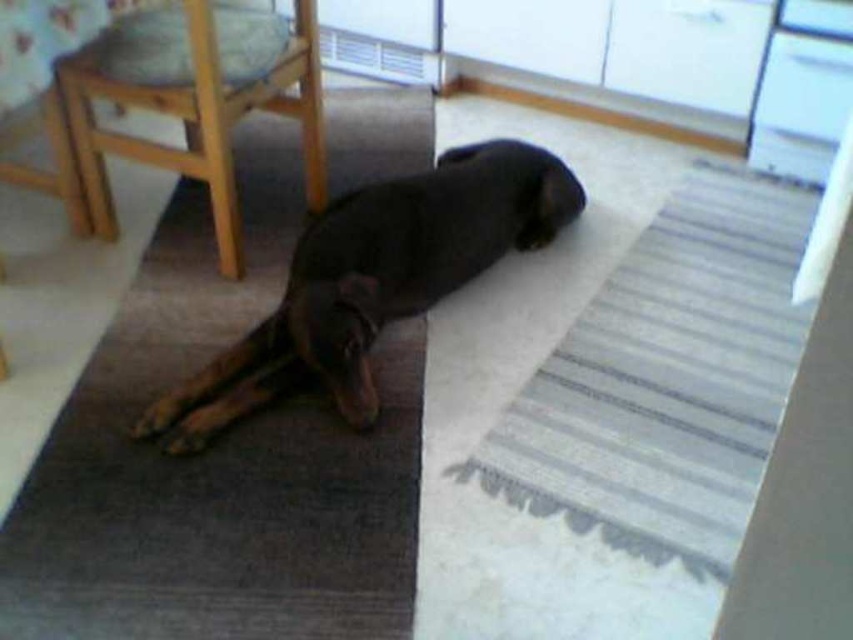
Between striped fabric mat at center and wooden chair at left, which one has less height?

wooden chair at left is shorter.

Is point (660, 288) closer to camera compared to point (96, 196)?

Yes.

Locate an element on the screen. The width and height of the screenshot is (853, 640). striped fabric mat at center is located at coordinates (668, 378).

Is the position of striped fabric mat at center less distant than that of black glossy dog at center?

Yes, striped fabric mat at center is closer to the viewer.

How far apart are striped fabric mat at center and black glossy dog at center?

striped fabric mat at center and black glossy dog at center are 45.74 centimeters apart.

Who is more distant from viewer, [734,349] or [535,173]?

Positioned behind is point [535,173].

Identify the location of striped fabric mat at center. The height and width of the screenshot is (640, 853). (668, 378).

Is black glossy dog at center positioned at the back of wooden chair at left?

That is False.

Which is in front, point (165, 404) or point (187, 4)?

Point (165, 404)

Which is behind, point (544, 195) or point (207, 129)?

The point (544, 195) is more distant.

Find the location of a particular element. Image resolution: width=853 pixels, height=640 pixels. black glossy dog at center is located at coordinates (374, 282).